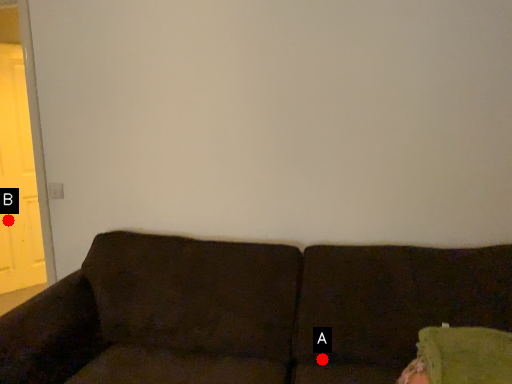
Question: Two points are circled on the image, labeled by A and B beside each circle. Which point appears closest to the camera in this image?

Choices:
 (A) A is closer
 (B) B is closer

Answer: (A)